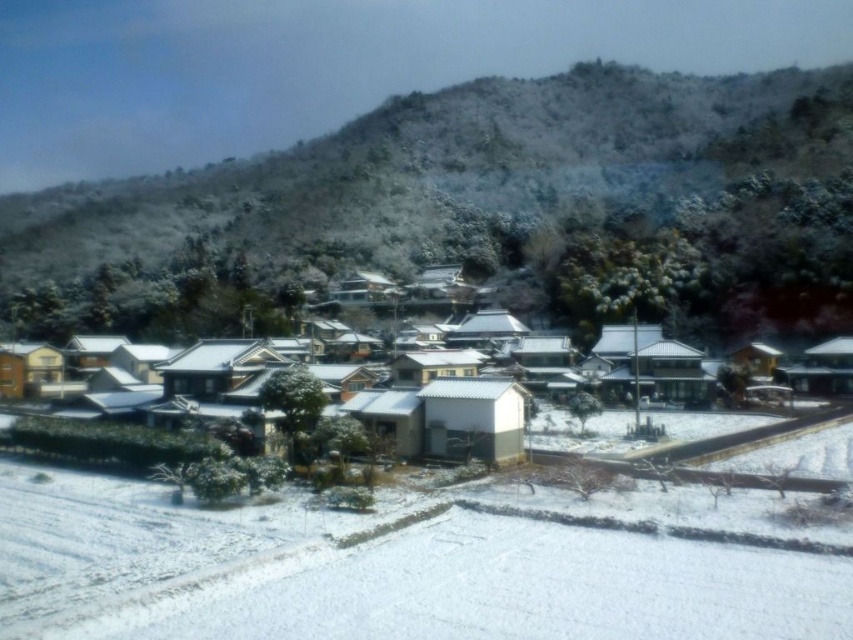
Can you confirm if snow-covered trees at upper center is taller than white matte houses at center?

Indeed, snow-covered trees at upper center has a greater height compared to white matte houses at center.

What do you see at coordinates (477, 209) in the screenshot? I see `snow-covered trees at upper center` at bounding box center [477, 209].

In order to click on snow-covered trees at upper center in this screenshot , I will do `click(477, 209)`.

Where is `snow-covered trees at upper center`? snow-covered trees at upper center is located at coordinates (477, 209).